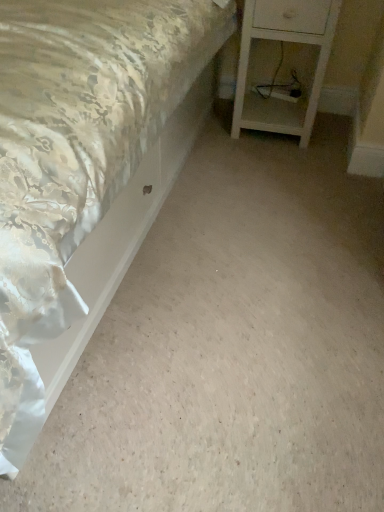
Question: Are silky satin bed at upper left and white wood nightstand at lower right located far from each other?

Choices:
 (A) no
 (B) yes

Answer: (A)

Question: Can you confirm if silky satin bed at upper left is shorter than white wood nightstand at lower right?

Choices:
 (A) no
 (B) yes

Answer: (B)

Question: From the image's perspective, is silky satin bed at upper left on white wood nightstand at lower right?

Choices:
 (A) no
 (B) yes

Answer: (A)

Question: Can you confirm if silky satin bed at upper left is thinner than white wood nightstand at lower right?

Choices:
 (A) no
 (B) yes

Answer: (A)

Question: Can you confirm if silky satin bed at upper left is smaller than white wood nightstand at lower right?

Choices:
 (A) yes
 (B) no

Answer: (B)

Question: Is silky satin bed at upper left in front of white wood nightstand at lower right?

Choices:
 (A) no
 (B) yes

Answer: (B)

Question: Does white wood nightstand at lower right have a greater width compared to silky satin bed at upper left?

Choices:
 (A) yes
 (B) no

Answer: (B)

Question: Is white wood nightstand at lower right positioned beyond the bounds of silky satin bed at upper left?

Choices:
 (A) yes
 (B) no

Answer: (A)

Question: From a real-world perspective, is white wood nightstand at lower right positioned under silky satin bed at upper left based on gravity?

Choices:
 (A) yes
 (B) no

Answer: (B)

Question: Considering the relative sizes of white wood nightstand at lower right and silky satin bed at upper left in the image provided, is white wood nightstand at lower right smaller than silky satin bed at upper left?

Choices:
 (A) no
 (B) yes

Answer: (B)

Question: Is white wood nightstand at lower right with silky satin bed at upper left?

Choices:
 (A) no
 (B) yes

Answer: (A)

Question: From the image's perspective, is white wood nightstand at lower right located beneath silky satin bed at upper left?

Choices:
 (A) yes
 (B) no

Answer: (B)

Question: From the image's perspective, is silky satin bed at upper left positioned above or below white wood nightstand at lower right?

Choices:
 (A) below
 (B) above

Answer: (A)